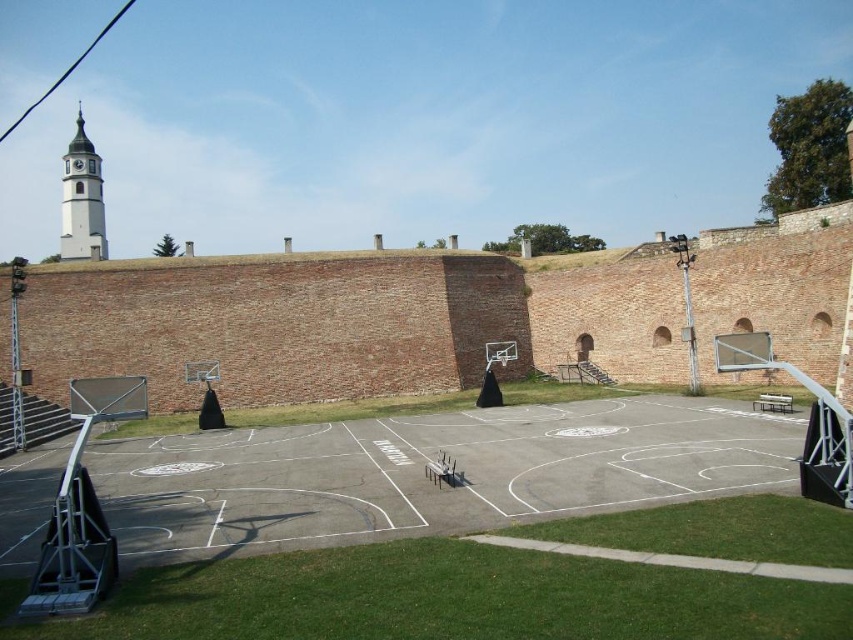
Does point (712, 484) come behind point (67, 193)?

No, it is in front of (67, 193).

Who is taller, smooth concrete basketball court at center or white stucco clock tower at upper left?

white stucco clock tower at upper left is taller.

Does point (146, 461) come farther from viewer compared to point (80, 259)?

No, it is not.

The width and height of the screenshot is (853, 640). I want to click on smooth concrete basketball court at center, so click(426, 480).